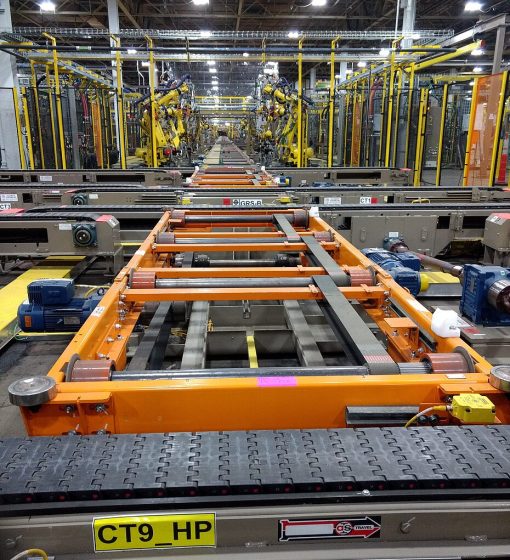
Where is `vertical pipes`? This screenshot has height=560, width=510. vertical pipes is located at coordinates (37, 110), (60, 107), (122, 129), (149, 85), (299, 135), (330, 138), (390, 124), (419, 144), (441, 139).